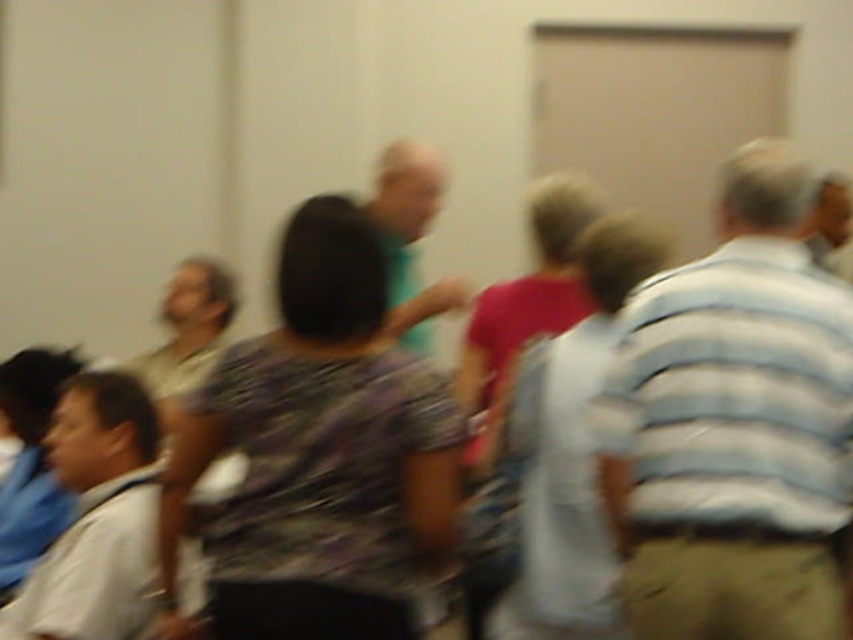
Is khaki pants at right positioned at the back of black matte shirt at center?

No, khaki pants at right is closer to the viewer.

Between point (790, 328) and point (444, 176), which one is positioned in front?

Positioned in front is point (790, 328).

What are the coordinates of `khaki pants at right` in the screenshot? It's located at (733, 426).

Does point (798, 483) lie in front of point (90, 419)?

Yes, point (798, 483) is in front of point (90, 419).

Can you confirm if khaki pants at right is positioned to the left of light gray shirt at lower left?

No, khaki pants at right is not to the left of light gray shirt at lower left.

Which is behind, point (751, 508) or point (4, 616)?

The point (4, 616) is more distant.

Where is `khaki pants at right`? This screenshot has width=853, height=640. khaki pants at right is located at coordinates (733, 426).

Which is in front, point (94, 634) or point (399, 310)?

Positioned in front is point (94, 634).

From the picture: Between light gray shirt at lower left and black matte shirt at center, which one is positioned lower?

light gray shirt at lower left is lower down.

Which is behind, point (137, 593) or point (405, 140)?

Point (405, 140)

You are a GUI agent. You are given a task and a screenshot of the screen. Output one action in this format:
    pyautogui.click(x=<x>, y=<y>)
    Task: Click on the light gray shirt at lower left
    This screenshot has height=640, width=853.
    Given the screenshot: What is the action you would take?
    click(x=96, y=516)